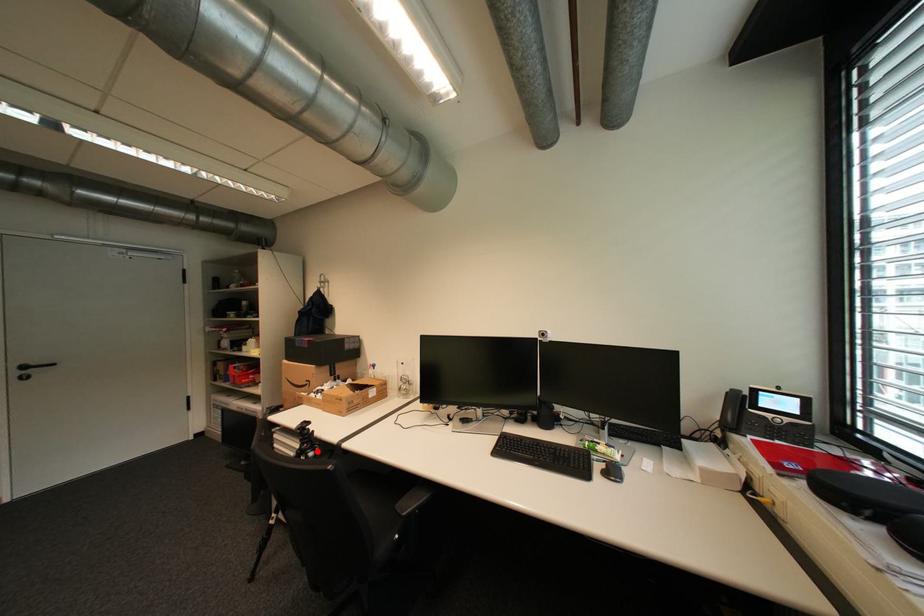
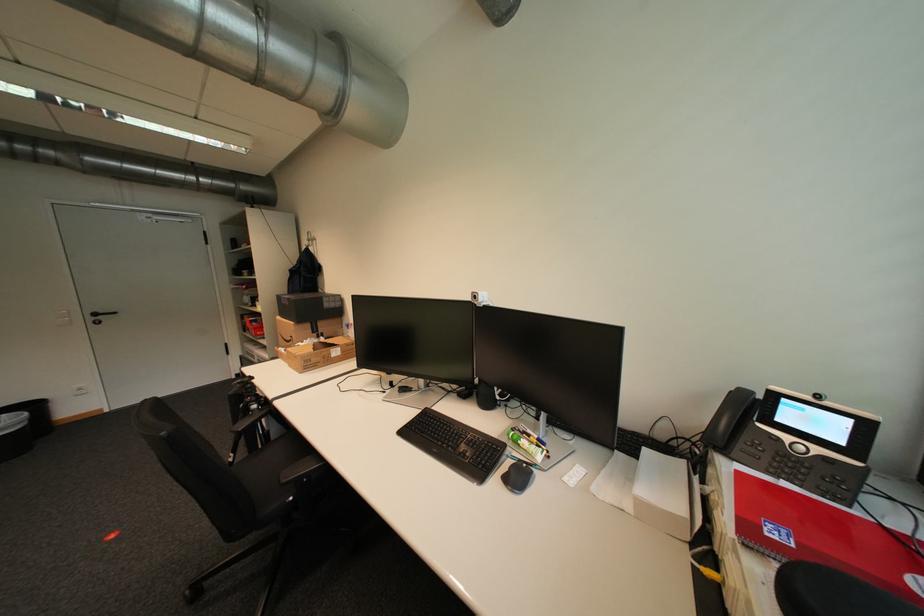
Locate, in the second image, the point that corresponds to the highlighted location in the first image.

(261, 403)